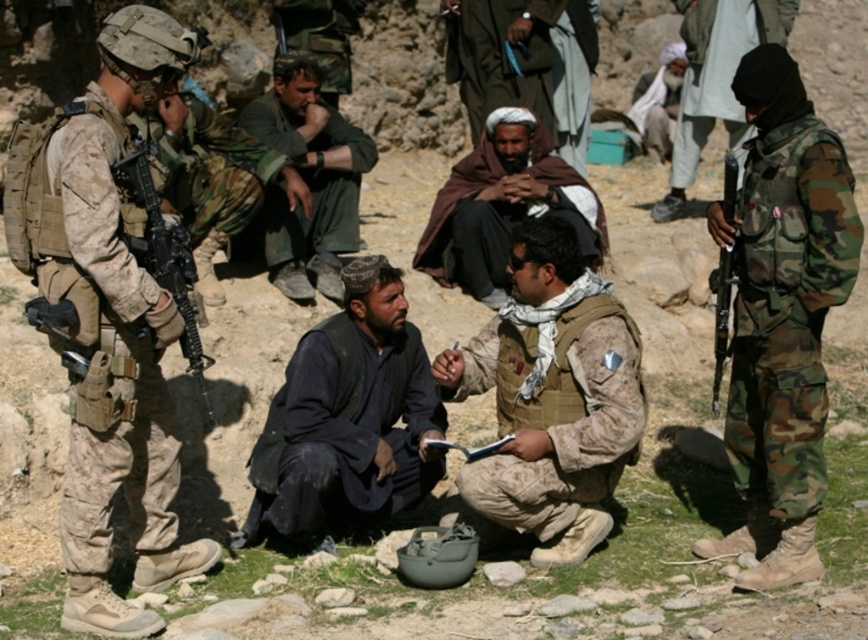
From the picture: You are a military analyst reviewing a satellite image. You notice a point at coordinates (549, 408). Based on the scene description, what object is located at that point?

The point at coordinates (549, 408) indicates the camouflage fabric vest at center.

You are a military observer positioned at the scene described. You need to determine if the brown woolen shawl at center is within your immediate vicinity to inspect it without moving more than 15 meters. Can you do so?

The brown woolen shawl at center is 17.31 meters away from viewer, so you cannot inspect it without moving more than 15 meters.